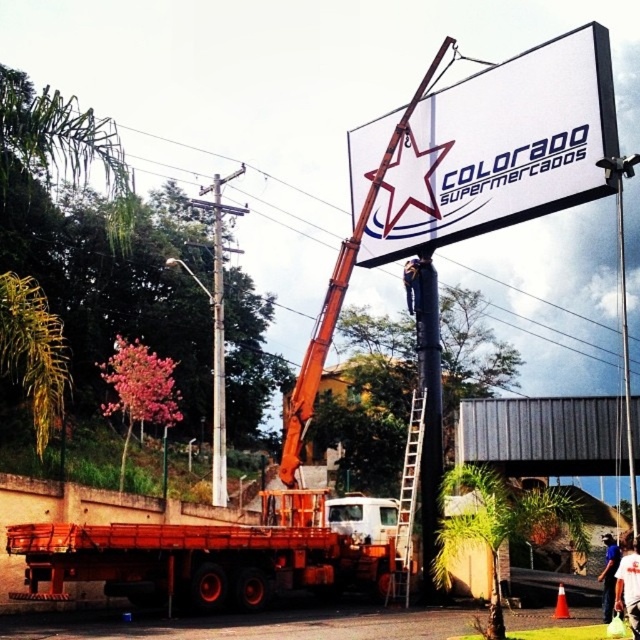
Does point (218, 192) come closer to viewer compared to point (612, 572)?

No, it is behind (612, 572).

Which is in front, point (225, 468) or point (609, 548)?

Positioned in front is point (609, 548).

Where is `brushed metal pole at upper center`? The image size is (640, 640). brushed metal pole at upper center is located at coordinates (218, 353).

Is black matte pole at center closer to camera compared to metallic ladder at center?

No, black matte pole at center is further to the viewer.

Between black matte pole at center and metallic ladder at center, which one has less height?

metallic ladder at center is shorter.

At what (x,y) coordinates should I click in order to perform the action: click on black matte pole at center. Please return your answer as a coordinate pair (x, y). The height and width of the screenshot is (640, 640). Looking at the image, I should click on (428, 410).

You are a GUI agent. You are given a task and a screenshot of the screen. Output one action in this format:
    pyautogui.click(x=<x>, y=<y>)
    Task: Click on the orange metallic trailer truck at center
    This screenshot has height=640, width=640.
    Given the screenshot: What is the action you would take?
    pyautogui.click(x=221, y=554)

Can you confirm if orange metallic trailer truck at center is positioned to the right of white hard hat at center?

→ No, orange metallic trailer truck at center is not to the right of white hard hat at center.

Which is in front, point (156, 532) or point (634, 570)?

Point (634, 570)

The width and height of the screenshot is (640, 640). Identify the location of orange metallic trailer truck at center. (221, 554).